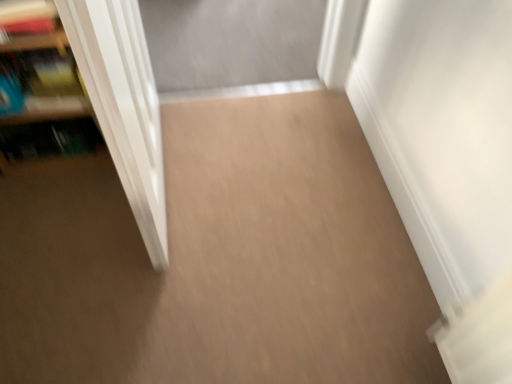
Question: Considering the relative positions of white glossy door at left and wooden bookshelf at left in the image provided, is white glossy door at left to the left or to the right of wooden bookshelf at left?

Choices:
 (A) right
 (B) left

Answer: (A)

Question: From the image's perspective, relative to wooden bookshelf at left, is white glossy door at left above or below?

Choices:
 (A) below
 (B) above

Answer: (A)

Question: Is white glossy door at left situated inside wooden bookshelf at left or outside?

Choices:
 (A) outside
 (B) inside

Answer: (A)

Question: Is wooden bookshelf at left taller or shorter than white glossy door at left?

Choices:
 (A) short
 (B) tall

Answer: (A)

Question: Considering the positions of point (1, 72) and point (147, 96), is point (1, 72) closer or farther from the camera than point (147, 96)?

Choices:
 (A) farther
 (B) closer

Answer: (B)

Question: Is wooden bookshelf at left inside the boundaries of white glossy door at left, or outside?

Choices:
 (A) inside
 (B) outside

Answer: (B)

Question: In terms of size, does wooden bookshelf at left appear bigger or smaller than white glossy door at left?

Choices:
 (A) big
 (B) small

Answer: (B)